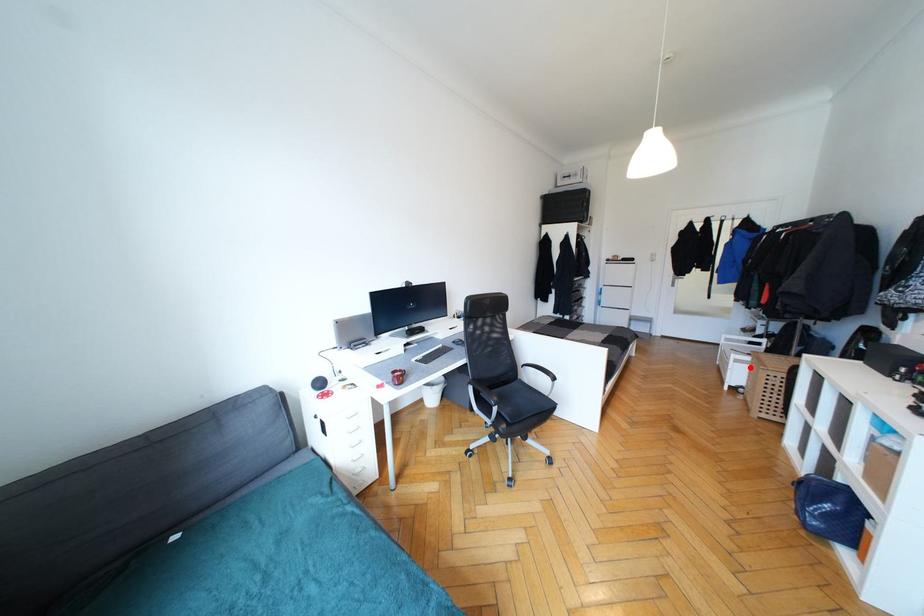
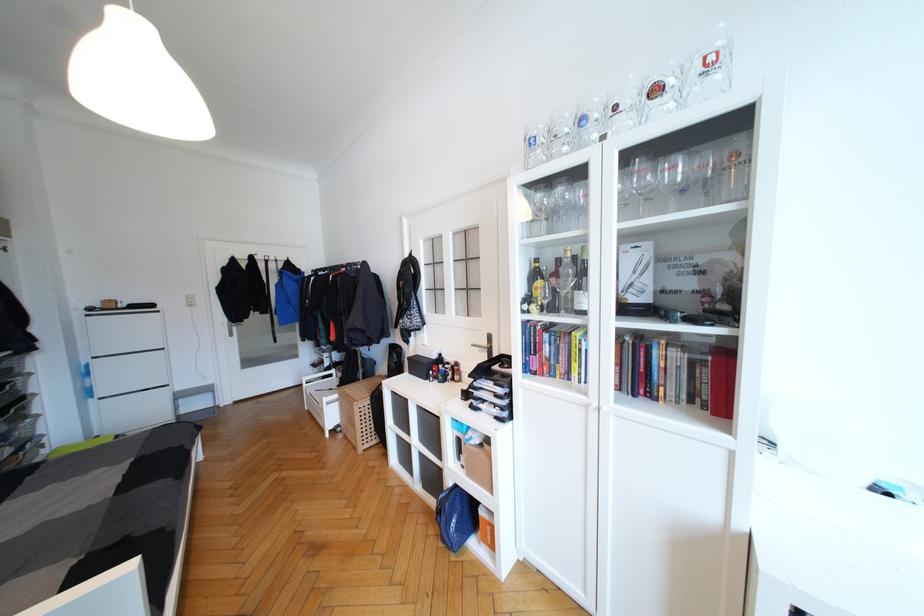
In the second image, find the point that corresponds to the highlighted location in the first image.

(339, 405)